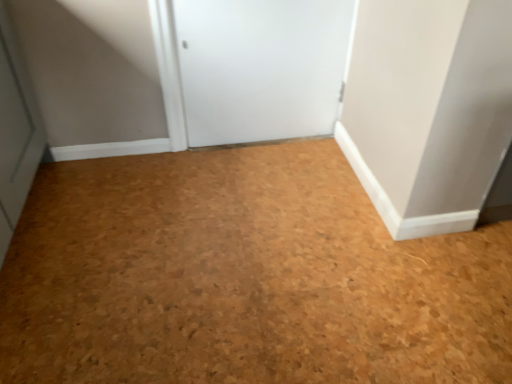
Question: Is cork floor at center closer to the viewer compared to white matte door at center?

Choices:
 (A) no
 (B) yes

Answer: (B)

Question: Does cork floor at center turn towards white matte door at center?

Choices:
 (A) no
 (B) yes

Answer: (A)

Question: Is cork floor at center at the left side of white matte door at center?

Choices:
 (A) yes
 (B) no

Answer: (B)

Question: Is cork floor at center to the right of white matte door at center from the viewer's perspective?

Choices:
 (A) no
 (B) yes

Answer: (B)

Question: Is cork floor at center not near white matte door at center?

Choices:
 (A) yes
 (B) no

Answer: (B)

Question: Can you confirm if cork floor at center is shorter than white matte door at center?

Choices:
 (A) no
 (B) yes

Answer: (B)

Question: Could you tell me if white matte door at center is turned towards cork floor at center?

Choices:
 (A) no
 (B) yes

Answer: (B)

Question: Considering the relative sizes of white matte door at center and cork floor at center in the image provided, is white matte door at center thinner than cork floor at center?

Choices:
 (A) yes
 (B) no

Answer: (A)

Question: Could cork floor at center be considered to be inside white matte door at center?

Choices:
 (A) no
 (B) yes

Answer: (A)

Question: Can you confirm if white matte door at center is wider than cork floor at center?

Choices:
 (A) no
 (B) yes

Answer: (A)

Question: Is white matte door at center bigger than cork floor at center?

Choices:
 (A) no
 (B) yes

Answer: (A)

Question: From the image's perspective, is white matte door at center beneath cork floor at center?

Choices:
 (A) yes
 (B) no

Answer: (B)

Question: Considering the relative positions of white matte door at center and cork floor at center in the image provided, is white matte door at center to the left or to the right of cork floor at center?

Choices:
 (A) left
 (B) right

Answer: (A)